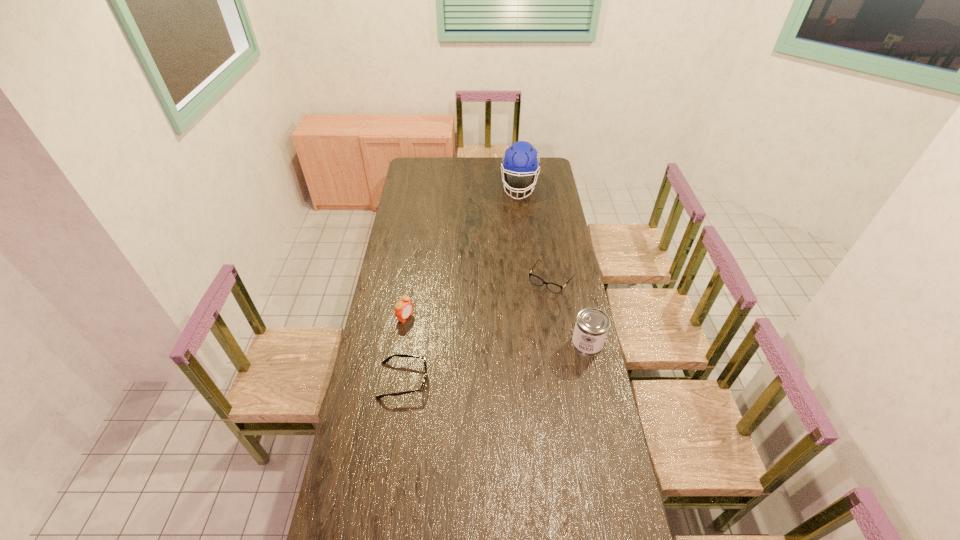
Where is `vacant space situated 0.380m on the front-facing side of the nearer spectacles`? This screenshot has height=540, width=960. vacant space situated 0.380m on the front-facing side of the nearer spectacles is located at coordinates (525, 380).

The width and height of the screenshot is (960, 540). Find the location of `vacant space located 0.390m on the back of the fourth farthest object`. vacant space located 0.390m on the back of the fourth farthest object is located at coordinates (571, 268).

Locate an element on the screen. free region located 0.340m on the front-facing side of the second farthest object is located at coordinates (504, 344).

The image size is (960, 540). Identify the location of blank space located on the front-facing side of the second farthest object. (528, 312).

At what (x,y) coordinates should I click in order to perform the action: click on free space located 0.060m on the front-facing side of the second farthest object. Please return your answer as a coordinate pair (x, y). This screenshot has width=960, height=540. Looking at the image, I should click on (535, 301).

I want to click on free space located 0.190m on the face of the third nearest object, so click(448, 339).

This screenshot has height=540, width=960. Find the location of `vacant region located 0.370m on the face of the third nearest object`. vacant region located 0.370m on the face of the third nearest object is located at coordinates coord(485,356).

The height and width of the screenshot is (540, 960). What are the coordinates of `vacant space located 0.070m on the face of the third nearest object` in the screenshot? It's located at (425, 327).

Locate an element on the screen. The width and height of the screenshot is (960, 540). free spot located on the front-facing side of the football helmet is located at coordinates (516, 211).

You are a GUI agent. You are given a task and a screenshot of the screen. Output one action in this format:
    pyautogui.click(x=<x>, y=<y>)
    Task: Click on the free space located 0.090m on the front-facing side of the football helmet
    This screenshot has height=540, width=960.
    Given the screenshot: What is the action you would take?
    pyautogui.click(x=516, y=211)